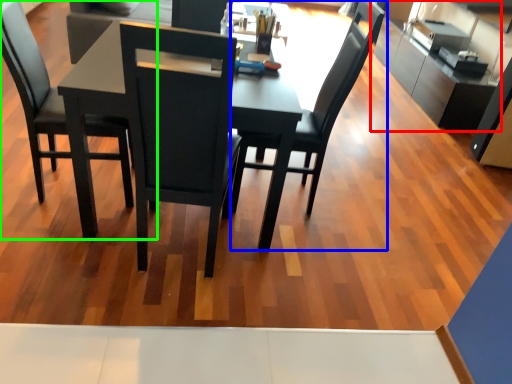
Question: Which is nearer to the cabinetry (highlighted by a red box)? chair (highlighted by a blue box) or chair (highlighted by a green box).

Choices:
 (A) chair
 (B) chair

Answer: (A)